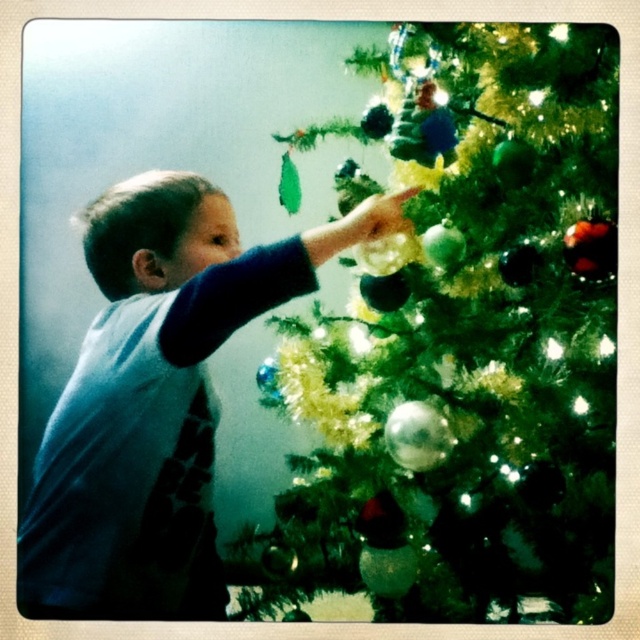
Question: From the image, what is the correct spatial relationship of green matte christmas tree at upper right in relation to blue cotton shirt at upper left?

Choices:
 (A) below
 (B) above

Answer: (B)

Question: Which point is farther to the camera?

Choices:
 (A) green matte christmas tree at upper right
 (B) blue cotton shirt at upper left

Answer: (A)

Question: Among these objects, which one is farthest from the camera?

Choices:
 (A) blue cotton shirt at upper left
 (B) green matte christmas tree at upper right

Answer: (B)

Question: Can you confirm if green matte christmas tree at upper right is smaller than blue cotton shirt at upper left?

Choices:
 (A) yes
 (B) no

Answer: (B)

Question: Is the position of green matte christmas tree at upper right more distant than that of blue cotton shirt at upper left?

Choices:
 (A) no
 (B) yes

Answer: (B)